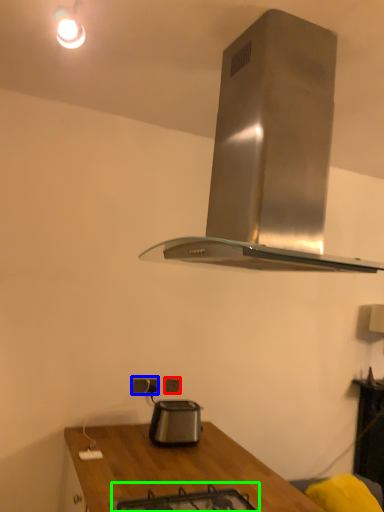
Question: Which is nearer to the electric outlet (highlighted by a red box)? electric outlet (highlighted by a blue box) or gas stove (highlighted by a green box).

Choices:
 (A) electric outlet
 (B) gas stove

Answer: (A)